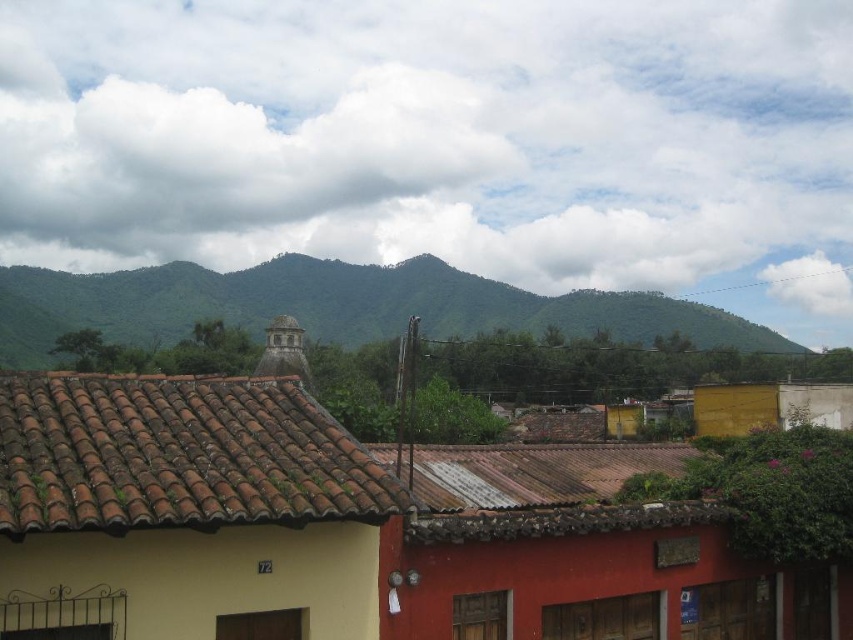
You are an architect planning to add a new structure to the town. You notice the white fluffy cloud at upper center and the brown clay tiles at upper left. Which of these two elements is bigger in size?

The white fluffy cloud at upper center is larger in size compared to the brown clay tiles at upper left according to the description.

Looking at this image, you are standing in the town square looking at the buildings. The brown clay tiles at upper left are part of which building? Please provide the building number if available.

The brown clay tiles at upper left are part of the building with the yellow facade marked with the number 72 on its wall.

Looking at the town scene, which object among the white fluffy cloud at upper center and the green leafy mountains at upper center takes up more space in the image?

The white fluffy cloud at upper center is larger in size than the green leafy mountains at upper center, so it takes up more space in the image.